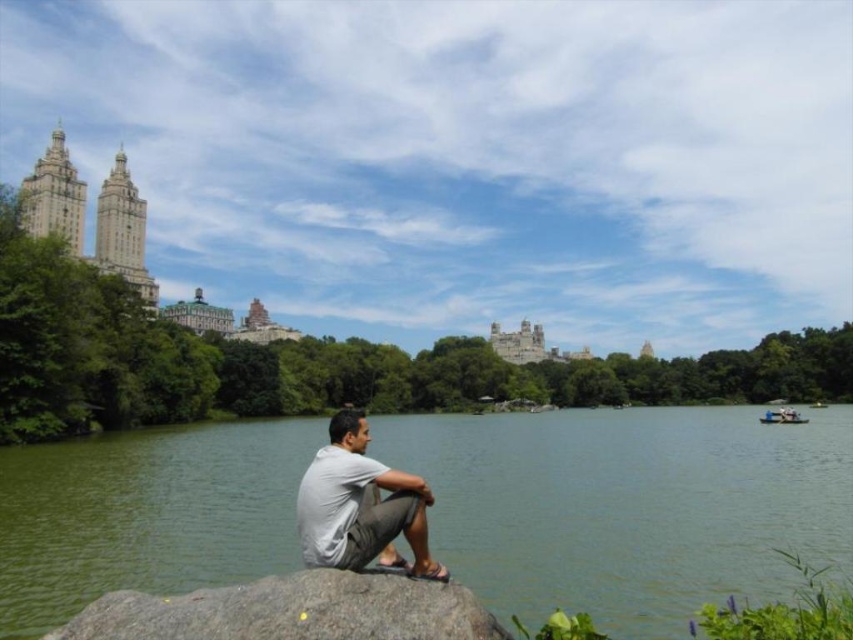
Question: Among these points, which one is nearest to the camera?

Choices:
 (A) [326, 467]
 (B) [204, 598]
 (C) [637, 595]

Answer: (B)

Question: Which point appears closest to the camera in this image?

Choices:
 (A) (680, 460)
 (B) (329, 497)

Answer: (B)

Question: Which point appears farthest from the camera in this image?

Choices:
 (A) (59, 502)
 (B) (323, 481)
 (C) (212, 596)

Answer: (A)

Question: Is gray granite rock at lower center wider than gray cotton shirt at lower center?

Choices:
 (A) no
 (B) yes

Answer: (B)

Question: Can you confirm if gray granite rock at lower center is wider than gray cotton shirt at lower center?

Choices:
 (A) yes
 (B) no

Answer: (A)

Question: Can you confirm if gray granite rock at lower center is positioned below gray cotton shirt at lower center?

Choices:
 (A) yes
 (B) no

Answer: (A)